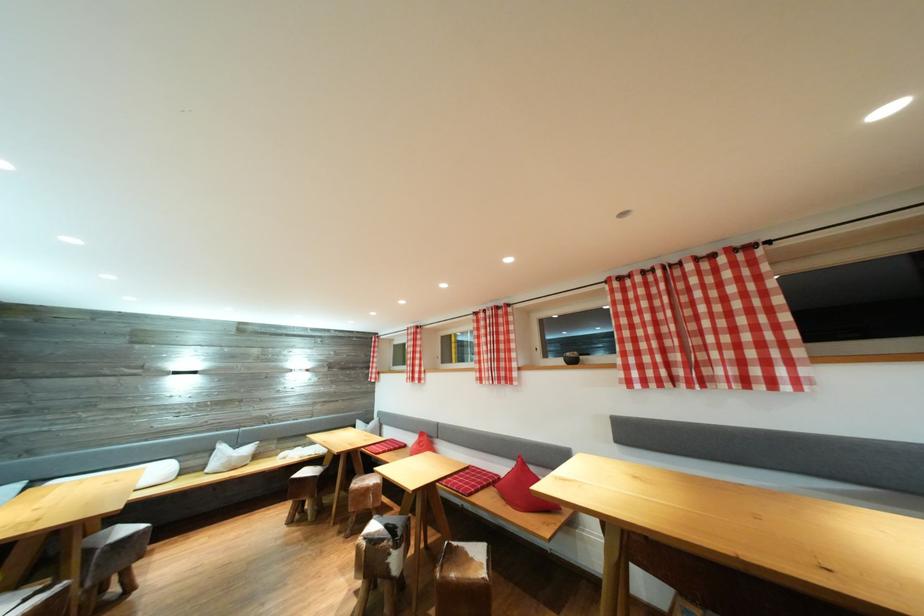
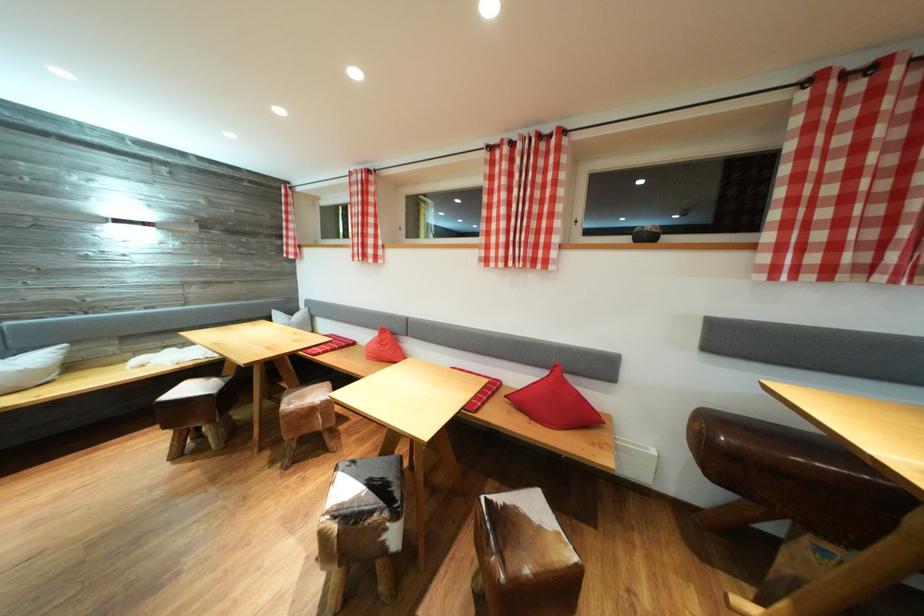
Find the pixel in the second image that matches point 373,496 in the first image.

(319, 416)